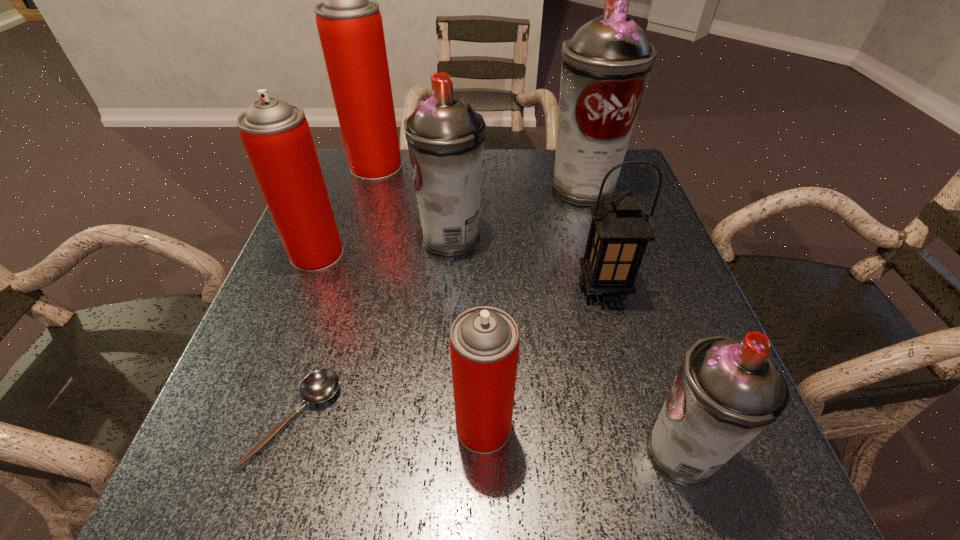
Locate an element on the screen. Image resolution: width=960 pixels, height=540 pixels. the shortest object is located at coordinates (320, 385).

Find the location of a particular element. The height and width of the screenshot is (540, 960). vacant space located 0.190m on the front of the biggest red aerosol can is located at coordinates (357, 225).

Identify the location of vacant space located on the front of the biggest gray aerosol can. The height and width of the screenshot is (540, 960). (600, 251).

Find the location of `free space located on the front of the second smallest red aerosol can`. free space located on the front of the second smallest red aerosol can is located at coordinates (276, 360).

Locate an element on the screen. blank area located on the right of the leftmost gray aerosol can is located at coordinates (520, 238).

Locate an element on the screen. vacant space located on the left of the black lantern is located at coordinates (440, 287).

You are a GUI agent. You are given a task and a screenshot of the screen. Output one action in this format:
    pyautogui.click(x=<x>, y=<y>)
    Task: Click on the free spot located 0.240m on the right of the nearest red aerosol can
    This screenshot has width=960, height=540.
    Given the screenshot: What is the action you would take?
    pyautogui.click(x=666, y=427)

You are a GUI agent. You are given a task and a screenshot of the screen. Output one action in this format:
    pyautogui.click(x=<x>, y=<y>)
    Task: Click on the free location located 0.170m on the back of the nearest gray aerosol can
    Image resolution: width=960 pixels, height=540 pixels.
    Given the screenshot: What is the action you would take?
    pyautogui.click(x=641, y=331)

Locate an element on the screen. vacant area situated 0.170m on the back of the ladle is located at coordinates (333, 300).

At what (x,y) coordinates should I click in order to perform the action: click on ladle situated at the near edge. Please return your answer as a coordinate pair (x, y). Looking at the image, I should click on (320, 385).